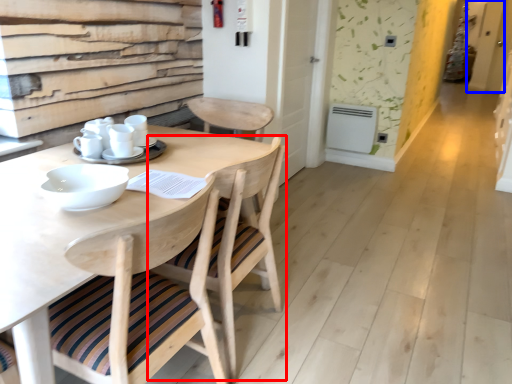
Question: Which object is closer to the camera taking this photo, chair (highlighted by a red box) or screen door (highlighted by a blue box)?

Choices:
 (A) chair
 (B) screen door

Answer: (A)